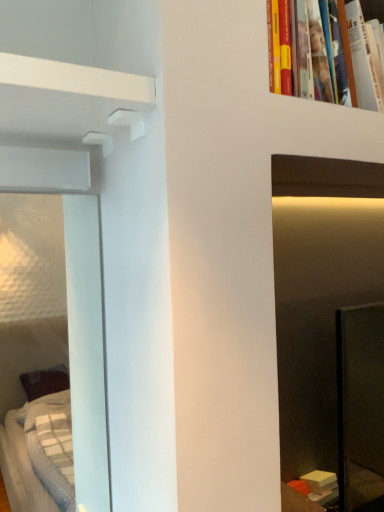
Looking at this image, in order to face hardcover book at upper right, should I rotate leftwards or rightwards?

You should rotate right by 18.906 degrees.

What do you see at coordinates (348, 49) in the screenshot? I see `hardcover book at upper right` at bounding box center [348, 49].

I want to click on hardcover book at upper right, so click(348, 49).

The height and width of the screenshot is (512, 384). I want to click on white matte shelf at upper left, so click(63, 91).

The height and width of the screenshot is (512, 384). What do you see at coordinates (63, 91) in the screenshot?
I see `white matte shelf at upper left` at bounding box center [63, 91].

At what (x,y) coordinates should I click in order to perform the action: click on hardcover book at upper right. Please return your answer as a coordinate pair (x, y). The image size is (384, 512). Looking at the image, I should click on (348, 49).

Is white matte shelf at upper left to the left or to the right of hardcover book at upper right in the image?

From the image, it's evident that white matte shelf at upper left is to the left of hardcover book at upper right.

Is white matte shelf at upper left further to the viewer compared to hardcover book at upper right?

No, the depth of white matte shelf at upper left is less than that of hardcover book at upper right.

Considering the positions of point (42, 127) and point (358, 2), is point (42, 127) closer or farther from the camera than point (358, 2)?

Point (42, 127) appears to be closer to the viewer than point (358, 2).

From the image's perspective, is white matte shelf at upper left beneath hardcover book at upper right?

Indeed, from the image's perspective, white matte shelf at upper left is shown beneath hardcover book at upper right.

From a real-world perspective, which is physically above, white matte shelf at upper left or hardcover book at upper right?

hardcover book at upper right is physically above.

Can you confirm if white matte shelf at upper left is thinner than hardcover book at upper right?

No.

In terms of height, does white matte shelf at upper left look taller or shorter compared to hardcover book at upper right?

Considering their sizes, white matte shelf at upper left has less height than hardcover book at upper right.

Based on their sizes in the image, would you say white matte shelf at upper left is bigger or smaller than hardcover book at upper right?

In the image, white matte shelf at upper left appears to be smaller than hardcover book at upper right.

Is white matte shelf at upper left completely or partially outside of hardcover book at upper right?

Yes, white matte shelf at upper left is not within hardcover book at upper right.

Are white matte shelf at upper left and hardcover book at upper right making contact?

There is a gap between white matte shelf at upper left and hardcover book at upper right.

Is white matte shelf at upper left aimed at hardcover book at upper right?

No, white matte shelf at upper left does not turn towards hardcover book at upper right.

How different are the orientations of white matte shelf at upper left and hardcover book at upper right in degrees?

The angle between the facing direction of white matte shelf at upper left and the facing direction of hardcover book at upper right is 0.000242 degrees.

This screenshot has height=512, width=384. Find the location of `book behind the white matte shelf at upper left`. book behind the white matte shelf at upper left is located at coordinates (348, 49).

Considering the relative positions of hardcover book at upper right and white matte shelf at upper left in the image provided, is hardcover book at upper right to the left or to the right of white matte shelf at upper left?

Based on their positions, hardcover book at upper right is located to the right of white matte shelf at upper left.

Which object is further away from the camera, hardcover book at upper right or white matte shelf at upper left?

hardcover book at upper right is more distant.

Is point (360, 91) farther from camera compared to point (76, 106)?

That is True.

From the image's perspective, is hardcover book at upper right above white matte shelf at upper left?

Yes.

From a real-world perspective, is hardcover book at upper right positioned under white matte shelf at upper left based on gravity?

Incorrect, from a real-world perspective, hardcover book at upper right is higher than white matte shelf at upper left.

Does hardcover book at upper right have a lesser width compared to white matte shelf at upper left?

Correct, the width of hardcover book at upper right is less than that of white matte shelf at upper left.

In terms of height, does hardcover book at upper right look taller or shorter compared to white matte shelf at upper left?

Clearly, hardcover book at upper right is taller compared to white matte shelf at upper left.

Who is bigger, hardcover book at upper right or white matte shelf at upper left?

hardcover book at upper right is bigger.

Would you say hardcover book at upper right is outside white matte shelf at upper left?

That's correct, hardcover book at upper right is outside of white matte shelf at upper left.

Is hardcover book at upper right not near white matte shelf at upper left?

No, hardcover book at upper right is in close proximity to white matte shelf at upper left.

Is white matte shelf at upper left at the back of hardcover book at upper right?

No, hardcover book at upper right's orientation is not away from white matte shelf at upper left.

How far apart are hardcover book at upper right and white matte shelf at upper left?

The distance of hardcover book at upper right from white matte shelf at upper left is 35.38 centimeters.

The image size is (384, 512). What are the coordinates of `book above the white matte shelf at upper left (from the image's perspective)` in the screenshot? It's located at (348, 49).

Find the location of a particular element. This screenshot has height=512, width=384. shelf lying on the left of hardcover book at upper right is located at coordinates (63, 91).

Image resolution: width=384 pixels, height=512 pixels. In order to click on book behind the white matte shelf at upper left in this screenshot , I will do `click(348, 49)`.